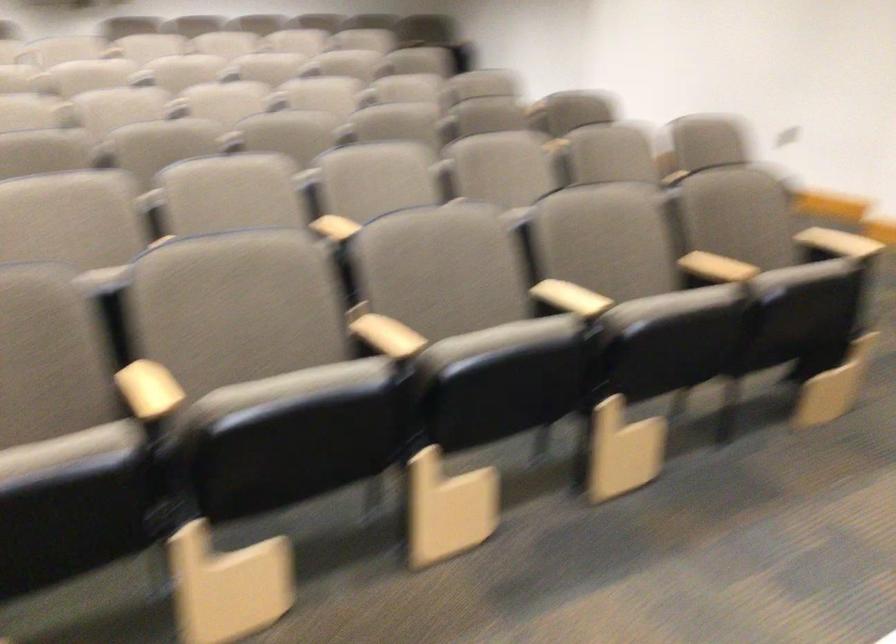
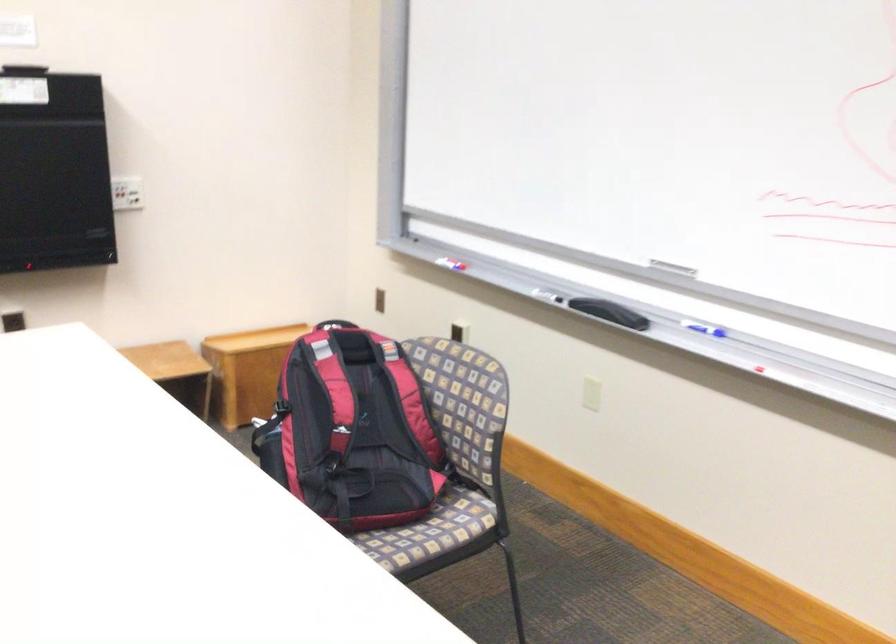
The first image is from the beginning of the video and the second image is from the end. How did the camera likely rotate when shooting the video?

The camera rotated toward right-down.